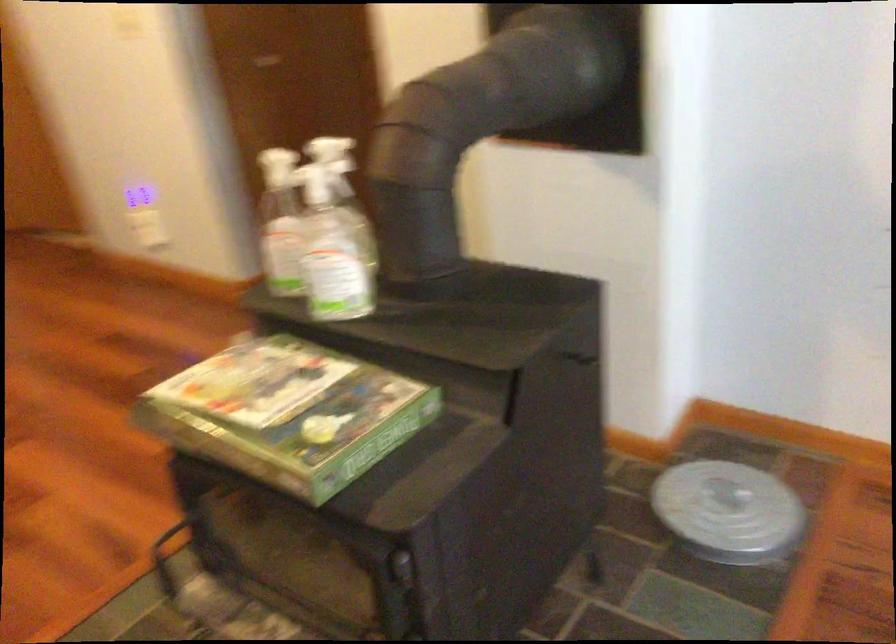
Find where to lift the green game box. Please return your answer as a coordinate pair (x, y).

(289, 413)